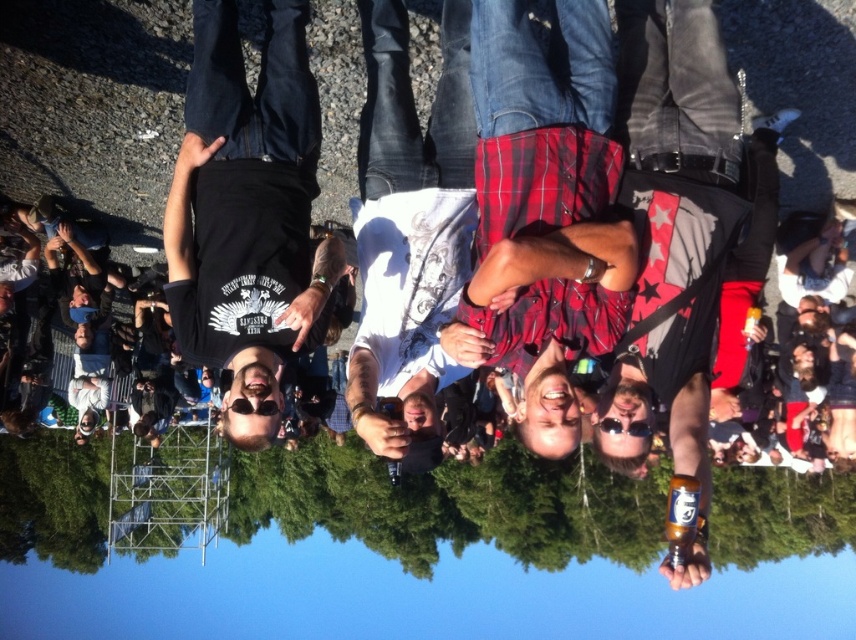
Question: Is black matte t-shirt at center thinner than white printed t-shirt at center?

Choices:
 (A) no
 (B) yes

Answer: (A)

Question: Observing the image, what is the correct spatial positioning of transparent blue water at bottom in reference to white printed t-shirt at center?

Choices:
 (A) above
 (B) below

Answer: (B)

Question: Among these objects, which one is nearest to the camera?

Choices:
 (A) black matte t-shirt at center
 (B) red plaid shorts at center
 (C) transparent blue water at bottom

Answer: (B)

Question: Which object appears farthest from the camera in this image?

Choices:
 (A) red plaid shorts at center
 (B) transparent blue water at bottom
 (C) black matte t-shirt at center

Answer: (B)

Question: Which point is farther to the camera?

Choices:
 (A) (373, 128)
 (B) (568, 177)
 (C) (532, 509)

Answer: (C)

Question: Can you confirm if transparent blue water at bottom is positioned below black matte t-shirt at center?

Choices:
 (A) no
 (B) yes

Answer: (B)